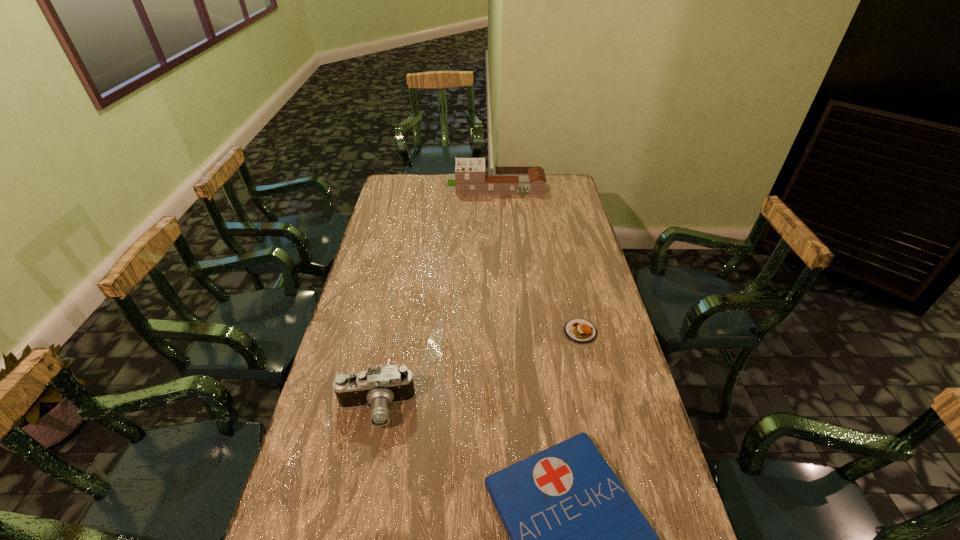
Where is `the tallest object`? This screenshot has height=540, width=960. the tallest object is located at coordinates (471, 177).

The height and width of the screenshot is (540, 960). Find the location of `dollhouse`. dollhouse is located at coordinates (471, 177).

Locate an element on the screen. The image size is (960, 540). the leftmost object is located at coordinates (378, 387).

You are a GUI agent. You are given a task and a screenshot of the screen. Output one action in this format:
    pyautogui.click(x=<x>, y=<y>)
    Task: Click on the camera
    This screenshot has width=960, height=540.
    Given the screenshot: What is the action you would take?
    pyautogui.click(x=378, y=387)

I want to click on the third nearest object, so click(581, 331).

Where is `blank space located 0.230m at the main entrance of the dollhouse`? The width and height of the screenshot is (960, 540). blank space located 0.230m at the main entrance of the dollhouse is located at coordinates (400, 184).

You are a GUI agent. You are given a task and a screenshot of the screen. Output one action in this format:
    pyautogui.click(x=<x>, y=<y>)
    Task: Click on the free space located 0.260m at the main entrance of the dollhouse
    This screenshot has width=960, height=540.
    Given the screenshot: What is the action you would take?
    pyautogui.click(x=395, y=184)

Where is `vacant space located at the main entrance of the dollhouse`? vacant space located at the main entrance of the dollhouse is located at coordinates (431, 184).

In order to click on vacant area situated at the lens of the second tallest object in this screenshot , I will do `click(366, 457)`.

Identify the location of free space located 0.110m on the back of the patty (food). This screenshot has height=540, width=960. (572, 297).